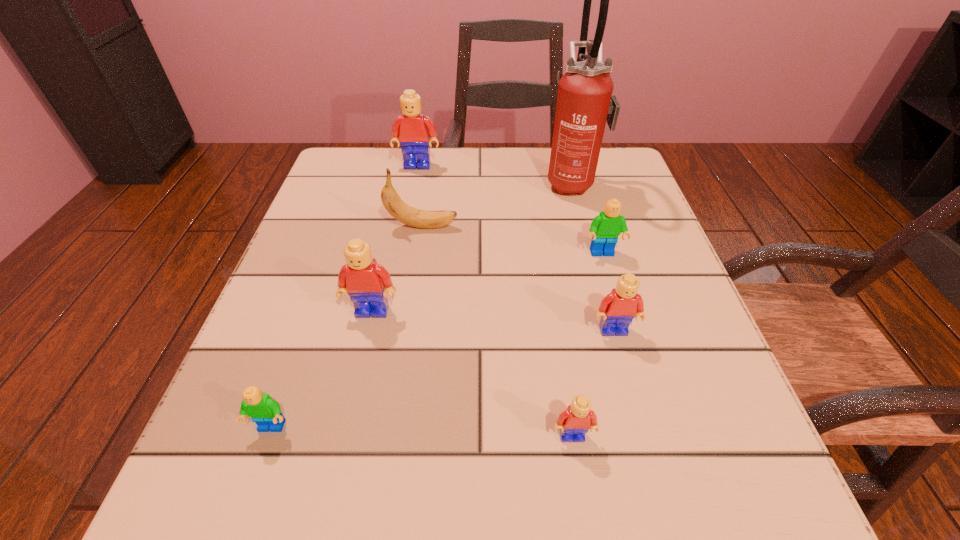
You are a GUI agent. You are given a task and a screenshot of the screen. Output one action in this format:
    pyautogui.click(x=<x>, y=<y>)
    Task: Click on the free space between the leftmost object and the banana
    Image resolution: width=960 pixels, height=540 pixels.
    Given the screenshot: What is the action you would take?
    pyautogui.click(x=347, y=327)

Image resolution: width=960 pixels, height=540 pixels. Find the location of `free space between the tallest Lego and the nearest yellow Lego`. free space between the tallest Lego and the nearest yellow Lego is located at coordinates (495, 300).

At what (x,y) coordinates should I click in order to perform the action: click on vacant area that lies between the fifth object from left to right and the sixth farthest object. Please return your answer as a coordinate pair (x, y). This screenshot has height=540, width=960. Looking at the image, I should click on (592, 383).

The width and height of the screenshot is (960, 540). What are the coordinates of `free space between the yellow banana and the seventh shortest object` in the screenshot? It's located at tap(420, 196).

The image size is (960, 540). Identify the location of free space that is in between the biggest yellow Lego and the second tallest Lego. (396, 238).

Find the location of a particular element. The height and width of the screenshot is (540, 960). free spot between the nearest yellow Lego and the fire extinguisher is located at coordinates (572, 309).

Find the location of `unoccupied position between the second tallest object and the fourth nearest Lego`. unoccupied position between the second tallest object and the fourth nearest Lego is located at coordinates (396, 238).

Find the location of a particular element. Image resolution: width=960 pixels, height=540 pixels. the fourth closest object to the farthest yellow Lego is located at coordinates (367, 282).

Identify which object is located as the seventh nearest to the third smallest yellow Lego. Please provide its 2D coordinates. Your answer should be formatted as a tuple, i.e. [(x, y)], where the tuple contains the x and y coordinates of a point satisfying the conditions above.

[(412, 129)]

This screenshot has height=540, width=960. What are the coordinates of `Lego that is the fourth nearest to the second tallest object` in the screenshot? It's located at (264, 411).